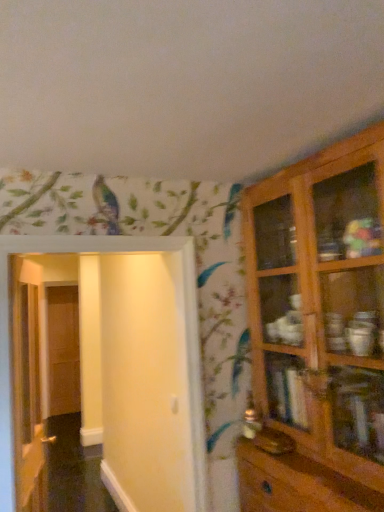
The image size is (384, 512). Describe the element at coordinates (317, 332) in the screenshot. I see `wooden cabinet at right` at that location.

What do you see at coordinates (129, 366) in the screenshot? I see `white matte door at left, arranged as the first door when viewed from the right` at bounding box center [129, 366].

What do you see at coordinates (63, 350) in the screenshot? The height and width of the screenshot is (512, 384). I see `wooden door at left, the 3th door positioned from the right` at bounding box center [63, 350].

Where is `wooden door at left, the first door from the left`? wooden door at left, the first door from the left is located at coordinates (63, 350).

Measure the distance between point (31,493) and camera.

2.13 meters.

You are a GUI agent. You are given a task and a screenshot of the screen. Output one action in this format:
    pyautogui.click(x=<x>, y=<y>)
    Task: Click on the wooden cabinet at right
    
    Given the screenshot: What is the action you would take?
    pyautogui.click(x=317, y=332)

What's the angular difference between white glossy door at left, which is counted as the second door, starting from the right, and white matte door at left, marked as the 3th door in a back-to-front arrangement,'s facing directions?

The facing directions of white glossy door at left, which is counted as the second door, starting from the right, and white matte door at left, marked as the 3th door in a back-to-front arrangement, are 76.1 degrees apart.

Is white glossy door at left, which is the 2th door in front-to-back order, shorter than white matte door at left, arranged as the third door when viewed from the left?

No, white glossy door at left, which is the 2th door in front-to-back order, is not shorter than white matte door at left, arranged as the third door when viewed from the left.

From the image's perspective, count 1st doors downward from the white matte door at left, marked as the 3th door in a back-to-front arrangement, and point to it. Please provide its 2D coordinates.

[(27, 393)]

Is point (37, 318) positioned behind point (6, 489)?

That is True.

Is wooden cabinet at right taller or shorter than white glossy door at left, positioned as the 2th door in left-to-right order?

wooden cabinet at right is taller than white glossy door at left, positioned as the 2th door in left-to-right order.

In the scene shown: From the image's perspective, is wooden cabinet at right on white glossy door at left, which is the 2th door in front-to-back order?

Indeed, from the image's perspective, wooden cabinet at right is shown above white glossy door at left, which is the 2th door in front-to-back order.

Is point (364, 420) closer to viewer compared to point (42, 420)?

Yes.

I want to click on the 2nd door behind when counting from the wooden cabinet at right, so click(x=27, y=393).

Is white matte door at left, marked as the 3th door in a back-to-front arrangement, inside or outside of wooden cabinet at right?

white matte door at left, marked as the 3th door in a back-to-front arrangement, is not inside wooden cabinet at right, it's outside.

Is white matte door at left, marked as the 3th door in a back-to-front arrangement, oriented towards wooden cabinet at right?

No.

Can you confirm if white matte door at left, marked as the 3th door in a back-to-front arrangement, is smaller than wooden cabinet at right?

Yes.

Which is nearer, (193, 465) or (368, 375)?

The point (368, 375) is in front.

At what (x,y) coordinates should I click in order to perform the action: click on cupboard lying on the right of white glossy door at left, which is the 2th door from back to front. Please return your answer as a coordinate pair (x, y). The image size is (384, 512). Looking at the image, I should click on (317, 332).

From the image's perspective, between white glossy door at left, which is the 2th door in front-to-back order, and wooden cabinet at right, which one is located above?

wooden cabinet at right.

Can you confirm if white glossy door at left, positioned as the 2th door in left-to-right order, is positioned to the right of wooden cabinet at right?

No, white glossy door at left, positioned as the 2th door in left-to-right order, is not to the right of wooden cabinet at right.

From a real-world perspective, which object rests below the other?

From a 3D spatial view, white glossy door at left, which is counted as the second door, starting from the right, is below.

Is white glossy door at left, which is the 2th door from back to front, at the back of white matte door at left, positioned as the first door in front-to-back order?

Correct, white matte door at left, positioned as the first door in front-to-back order, is looking away from white glossy door at left, which is the 2th door from back to front.

Between white matte door at left, marked as the 3th door in a back-to-front arrangement, and white glossy door at left, which is counted as the second door, starting from the right, which one has more height?

white glossy door at left, which is counted as the second door, starting from the right, is taller.

Would you say white glossy door at left, which is the 2th door in front-to-back order, is part of white matte door at left, positioned as the first door in front-to-back order,'s contents?

That's incorrect, white glossy door at left, which is the 2th door in front-to-back order, is not inside white matte door at left, positioned as the first door in front-to-back order.

Could you measure the distance between white matte door at left, positioned as the first door in front-to-back order, and white glossy door at left, which is the 2th door in front-to-back order?

31.69 inches.

From a real-world perspective, is wooden cabinet at right located higher than wooden door at left, the first door from the left?

Yes, from a real-world perspective, wooden cabinet at right is on top of wooden door at left, the first door from the left.

Is point (349, 440) in front of point (73, 313)?

That is True.

At what (x,y) coordinates should I click in order to perform the action: click on the 3rd door counting from the left side of the wooden cabinet at right. Please return your answer as a coordinate pair (x, y). The image size is (384, 512). Looking at the image, I should click on (63, 350).

Is wooden door at left, placed as the 1th door when sorted from back to front, closer to the viewer compared to white matte door at left, positioned as the first door in front-to-back order?

No, it is not.

Could you measure the distance between wooden door at left, the 3th door positioned from the right, and white matte door at left, positioned as the first door in front-to-back order?

wooden door at left, the 3th door positioned from the right, and white matte door at left, positioned as the first door in front-to-back order, are 2.57 meters apart.

Which is nearer, [51,404] or [102,351]?

The point [102,351] is in front.

From the image's perspective, is wooden door at left, placed as the 1th door when sorted from back to front, located above or below white matte door at left, arranged as the third door when viewed from the left?

wooden door at left, placed as the 1th door when sorted from back to front, is below white matte door at left, arranged as the third door when viewed from the left.

The height and width of the screenshot is (512, 384). Find the location of `door that is the 1st object directly below the white matte door at left, arranged as the first door when viewed from the right (from a real-world perspective)`. door that is the 1st object directly below the white matte door at left, arranged as the first door when viewed from the right (from a real-world perspective) is located at coordinates (27, 393).

Image resolution: width=384 pixels, height=512 pixels. Find the location of `cupboard that appears above the white glossy door at left, which is the 2th door from back to front (from the image's perspective)`. cupboard that appears above the white glossy door at left, which is the 2th door from back to front (from the image's perspective) is located at coordinates (317, 332).

Considering their positions, is wooden door at left, arranged as the 3th door when viewed from the front, positioned closer to white glossy door at left, positioned as the 2th door in left-to-right order, than wooden cabinet at right?

wooden cabinet at right.

Considering their positions, is wooden cabinet at right positioned closer to white glossy door at left, which is the 2th door in front-to-back order, than white matte door at left, arranged as the first door when viewed from the right?

white matte door at left, arranged as the first door when viewed from the right, lies closer to white glossy door at left, which is the 2th door in front-to-back order, than the other object.

From the image, which object appears to be nearer to white matte door at left, arranged as the third door when viewed from the left, wooden cabinet at right or wooden door at left, the first door from the left?

wooden cabinet at right is closer to white matte door at left, arranged as the third door when viewed from the left.

Looking at the image, which one is located further to wooden cabinet at right, white glossy door at left, positioned as the 2th door in left-to-right order, or white matte door at left, marked as the 3th door in a back-to-front arrangement?

white glossy door at left, positioned as the 2th door in left-to-right order.

Looking at the image, which one is located closer to wooden door at left, placed as the 1th door when sorted from back to front, white glossy door at left, which is counted as the second door, starting from the right, or white matte door at left, positioned as the first door in front-to-back order?

white matte door at left, positioned as the first door in front-to-back order, is closer to wooden door at left, placed as the 1th door when sorted from back to front.

Considering their positions, is white matte door at left, positioned as the first door in front-to-back order, positioned further to white glossy door at left, which is the 2th door in front-to-back order, than wooden cabinet at right?

The object further to white glossy door at left, which is the 2th door in front-to-back order, is wooden cabinet at right.

From the picture: When comparing their distances from wooden cabinet at right, does white matte door at left, arranged as the third door when viewed from the left, or white glossy door at left, which is the 2th door in front-to-back order, seem closer?

white matte door at left, arranged as the third door when viewed from the left.

Considering their positions, is wooden door at left, the 3th door positioned from the right, positioned closer to white matte door at left, marked as the 3th door in a back-to-front arrangement, than white glossy door at left, positioned as the 2th door in left-to-right order?

white glossy door at left, positioned as the 2th door in left-to-right order, is positioned closer to the anchor white matte door at left, marked as the 3th door in a back-to-front arrangement.

Where is `door between white glossy door at left, which is the 2th door in front-to-back order, and wooden cabinet at right from left to right`? This screenshot has width=384, height=512. door between white glossy door at left, which is the 2th door in front-to-back order, and wooden cabinet at right from left to right is located at coordinates (129, 366).

Where is `door located between white matte door at left, positioned as the first door in front-to-back order, and wooden door at left, arranged as the 3th door when viewed from the front, in the depth direction`? This screenshot has width=384, height=512. door located between white matte door at left, positioned as the first door in front-to-back order, and wooden door at left, arranged as the 3th door when viewed from the front, in the depth direction is located at coordinates (27, 393).